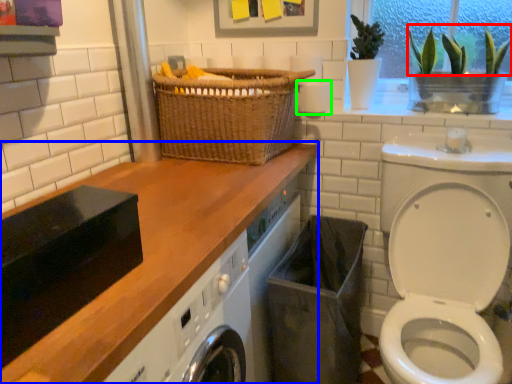
Question: Which is farther away from plant (highlighted by a red box)? countertop (highlighted by a blue box) or toilet paper (highlighted by a green box)?

Choices:
 (A) countertop
 (B) toilet paper

Answer: (A)